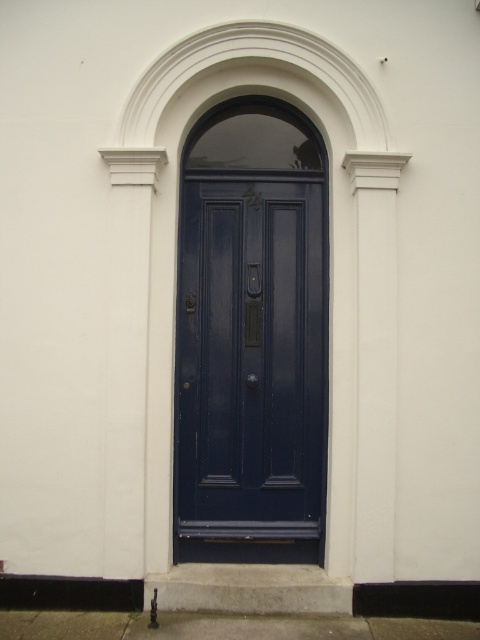
Question: Does glossy wood door at center appear on the left side of white smooth column at right?

Choices:
 (A) yes
 (B) no

Answer: (A)

Question: Can you confirm if glossy wood door at center is positioned below white smooth column at right?

Choices:
 (A) no
 (B) yes

Answer: (A)

Question: Among these points, which one is farthest from the camera?

Choices:
 (A) (375, 436)
 (B) (182, 388)

Answer: (B)

Question: Can you confirm if glossy wood door at center is positioned to the left of white smooth column at right?

Choices:
 (A) yes
 (B) no

Answer: (A)

Question: Which of the following is the closest to the observer?

Choices:
 (A) glossy wood door at center
 (B) white smooth column at right

Answer: (B)

Question: Which point is farther to the camera?

Choices:
 (A) (357, 554)
 (B) (202, 285)

Answer: (B)